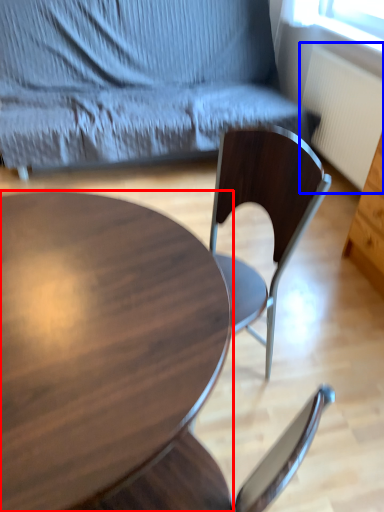
Question: Which of the following is the farthest to the observer, coffee table (highlighted by a red box) or radiator (highlighted by a blue box)?

Choices:
 (A) coffee table
 (B) radiator

Answer: (B)